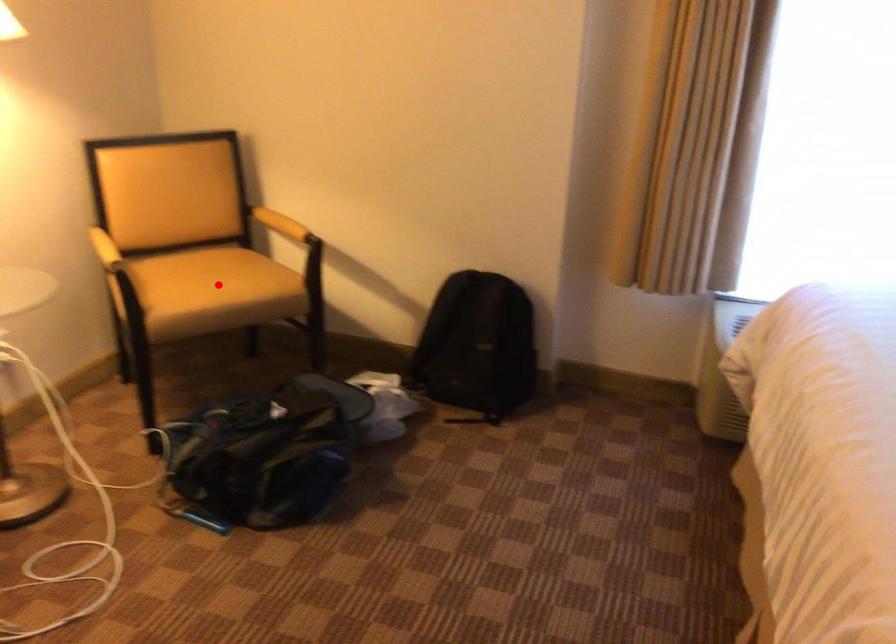
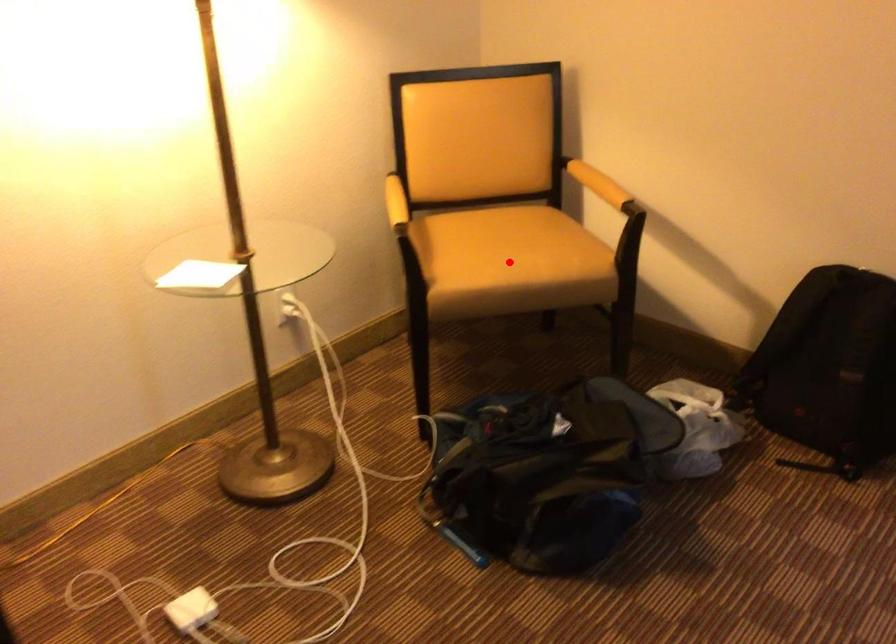
I am providing you with two images of the same scene from different viewpoints. A red point is marked on the first image and another point is marked on the second image. Do the highlighted points in image1 and image2 indicate the same real-world spot?

Yes